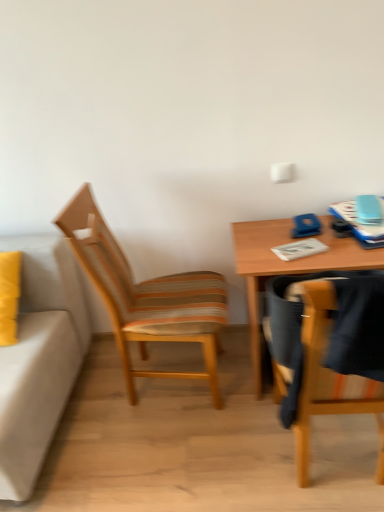
Image resolution: width=384 pixels, height=512 pixels. Identify the location of vacant area that is situated to the right of white paper notepad at center. (348, 246).